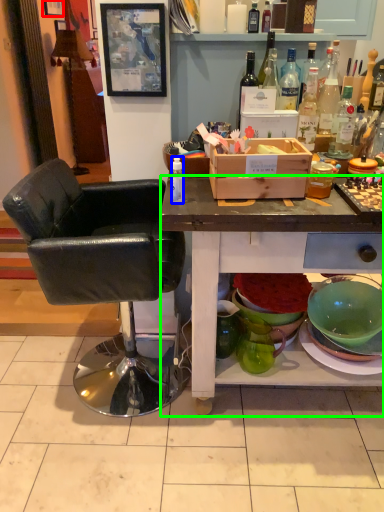
Question: Based on their relative distances, which object is farther from picture frame (highlighted by a red box)? Choose from bottle (highlighted by a blue box) and desk (highlighted by a green box).

Choices:
 (A) bottle
 (B) desk

Answer: (B)